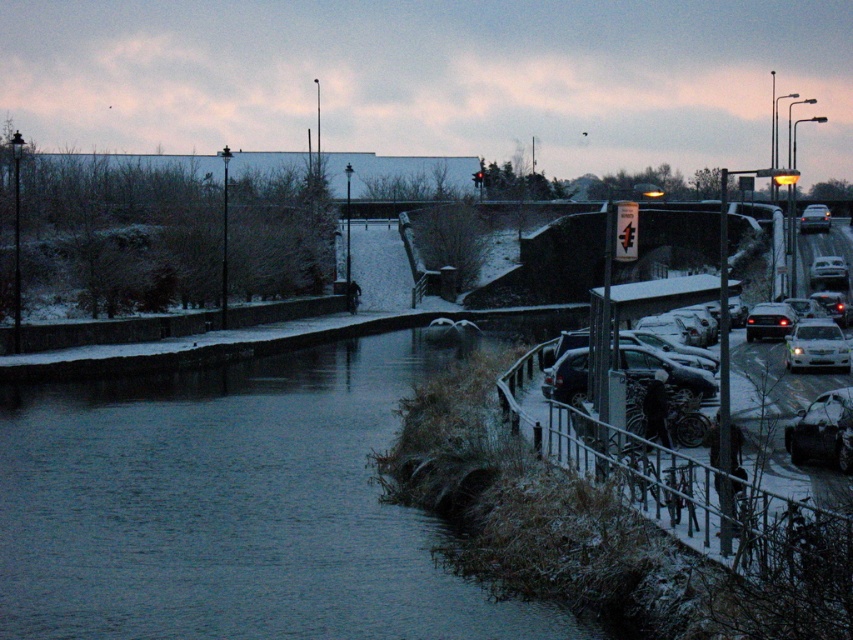
Question: Among these objects, which one is farthest from the camera?

Choices:
 (A) shiny silver car at lower right
 (B) white matte car at right

Answer: (B)

Question: Is white glossy sedan at right in front of shiny black sedan at right?

Choices:
 (A) no
 (B) yes

Answer: (B)

Question: Does shiny black sedan at right have a lesser width compared to white matte car at right?

Choices:
 (A) yes
 (B) no

Answer: (B)

Question: Observing the image, what is the correct spatial positioning of dark blue water at center in reference to shiny black sedan at right?

Choices:
 (A) above
 (B) below

Answer: (B)

Question: Which of these objects is positioned closest to the shiny silver car at lower right?

Choices:
 (A) white glossy sedan at right
 (B) shiny black sedan at right
 (C) dark blue water at center

Answer: (C)

Question: Among these objects, which one is nearest to the camera?

Choices:
 (A) snow-covered car at right
 (B) dark blue water at center

Answer: (B)